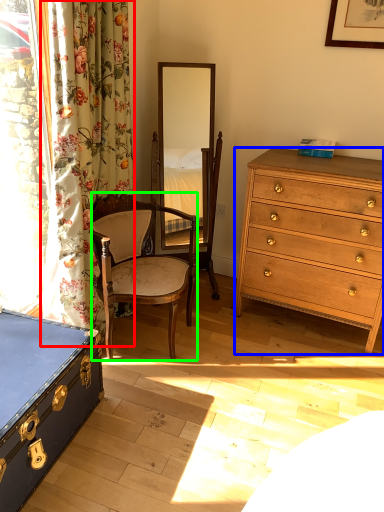
Question: Based on their relative distances, which object is nearer to curtain (highlighted by a red box)? Choose from chest of drawers (highlighted by a blue box) and chair (highlighted by a green box).

Choices:
 (A) chest of drawers
 (B) chair

Answer: (B)